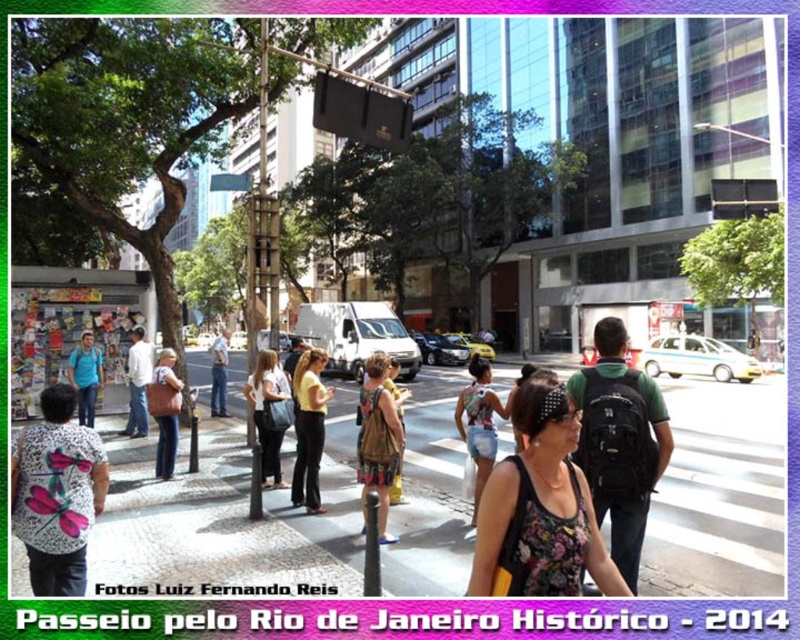
Can you confirm if matte black pants at center is positioned to the right of matte brown bag at center?

Indeed, matte black pants at center is positioned on the right side of matte brown bag at center.

Is matte black pants at center taller than matte brown bag at center?

Correct, matte black pants at center is much taller as matte brown bag at center.

Between point (276, 436) and point (164, 388), which one is positioned in front?

Point (276, 436) is more forward.

At what (x,y) coordinates should I click in order to perform the action: click on matte black pants at center. Please return your answer as a coordinate pair (x, y). Looking at the image, I should click on (268, 412).

Does point (372, 413) lie behind point (132, 397)?

No.

Does point (372, 419) lie behind point (144, 339)?

No, it is in front of (144, 339).

Find the location of a particular element. Image resolution: width=800 pixels, height=640 pixels. brown canvas bag at center is located at coordinates (378, 440).

Is matte black pants at center in front of white shirt at center?

Yes.

Who is higher up, matte black pants at center or white shirt at center?

white shirt at center

Who is more distant from viewer, [268,384] or [136,368]?

The point [136,368] is more distant.

This screenshot has height=640, width=800. In order to click on matte black pants at center in this screenshot , I will do `click(268, 412)`.